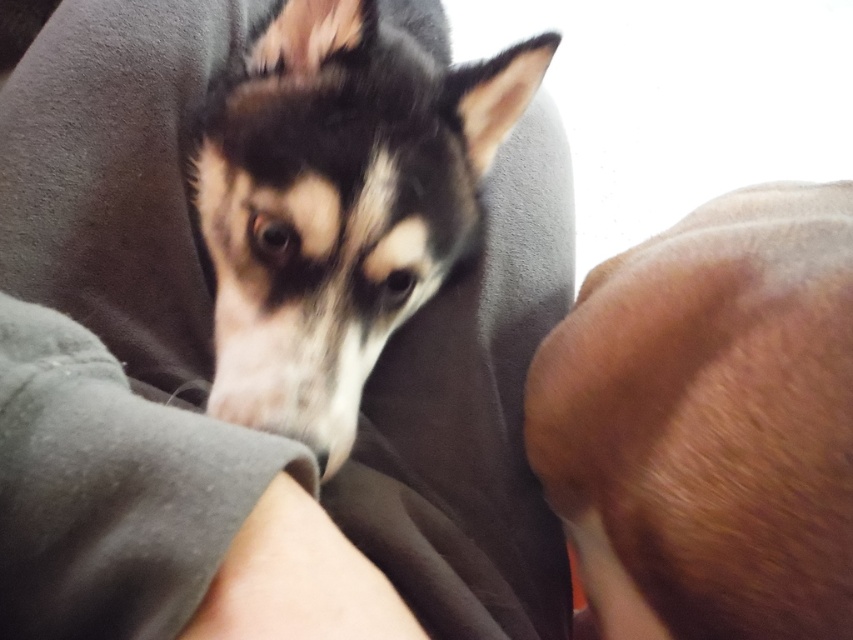
Question: Where is brown fur at lower right located in relation to black fur dog at center in the image?

Choices:
 (A) right
 (B) left

Answer: (A)

Question: In this image, where is brown fur at lower right located relative to black fur dog at center?

Choices:
 (A) right
 (B) left

Answer: (A)

Question: From the image, what is the correct spatial relationship of brown fur at lower right in relation to black fur dog at center?

Choices:
 (A) left
 (B) right

Answer: (B)

Question: Among these points, which one is farthest from the camera?

Choices:
 (A) (212, 161)
 (B) (747, 442)

Answer: (A)

Question: Among these points, which one is farthest from the camera?

Choices:
 (A) (299, 12)
 (B) (851, 298)

Answer: (A)